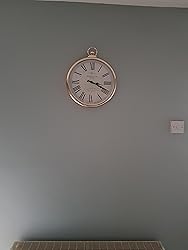
This screenshot has height=250, width=188. Find the location of `radiator`. radiator is located at coordinates (112, 243).